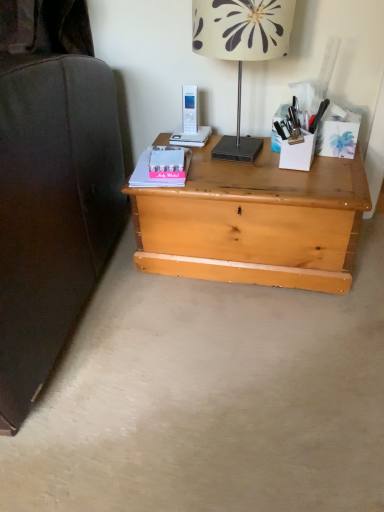
Question: From a real-world perspective, is light wood chest at center positioned over pink matte paperback book at center, placed as the 2th paperback book when sorted from front to back, based on gravity?

Choices:
 (A) no
 (B) yes

Answer: (A)

Question: Is light wood chest at center shorter than pink matte paperback book at center, placed as the 2th paperback book when sorted from front to back?

Choices:
 (A) yes
 (B) no

Answer: (B)

Question: Is light wood chest at center closer to camera compared to pink matte paperback book at center, placed as the 2th paperback book when sorted from front to back?

Choices:
 (A) no
 (B) yes

Answer: (B)

Question: Can you confirm if light wood chest at center is positioned to the left of pink matte paperback book at center, placed as the 2th paperback book when sorted from front to back?

Choices:
 (A) no
 (B) yes

Answer: (A)

Question: Can you confirm if light wood chest at center is taller than pink matte paperback book at center, the first paperback book when ordered from back to front?

Choices:
 (A) yes
 (B) no

Answer: (A)

Question: Considering the relative sizes of light wood chest at center and pink matte paperback book at center, the first paperback book when ordered from back to front, in the image provided, is light wood chest at center bigger than pink matte paperback book at center, the first paperback book when ordered from back to front,?

Choices:
 (A) no
 (B) yes

Answer: (B)

Question: Does light wood chest at center have a lesser width compared to white floral lampshade at upper center?

Choices:
 (A) yes
 (B) no

Answer: (B)

Question: Is light wood chest at center wider than white floral lampshade at upper center?

Choices:
 (A) no
 (B) yes

Answer: (B)

Question: Does light wood chest at center have a smaller size compared to white floral lampshade at upper center?

Choices:
 (A) no
 (B) yes

Answer: (A)

Question: From a real-world perspective, is light wood chest at center physically above white floral lampshade at upper center?

Choices:
 (A) no
 (B) yes

Answer: (A)

Question: Considering the relative positions of light wood chest at center and white floral lampshade at upper center in the image provided, is light wood chest at center to the right of white floral lampshade at upper center from the viewer's perspective?

Choices:
 (A) yes
 (B) no

Answer: (A)

Question: Is light wood chest at center aimed at white floral lampshade at upper center?

Choices:
 (A) yes
 (B) no

Answer: (B)

Question: Does white plastic phone at upper center have a smaller size compared to pink matte paperback book at center, placed as the 2th paperback book when sorted from front to back?

Choices:
 (A) no
 (B) yes

Answer: (A)